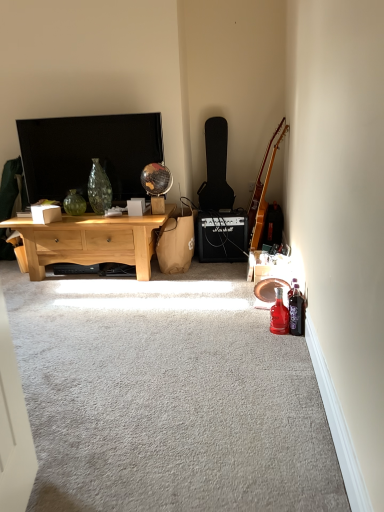
Image resolution: width=384 pixels, height=512 pixels. I want to click on vacant space that is to the left of metallic silver mechanical fan at lower right, so click(x=235, y=298).